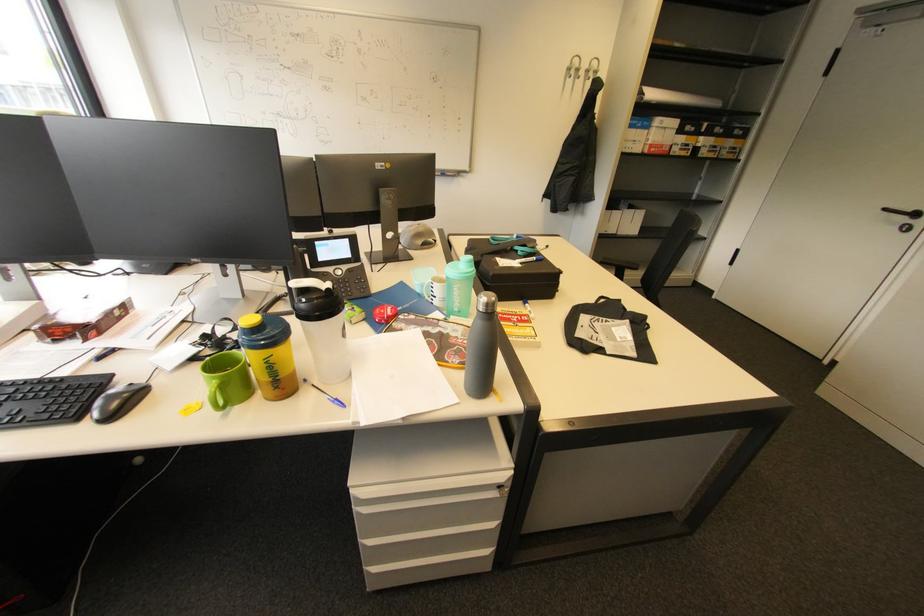
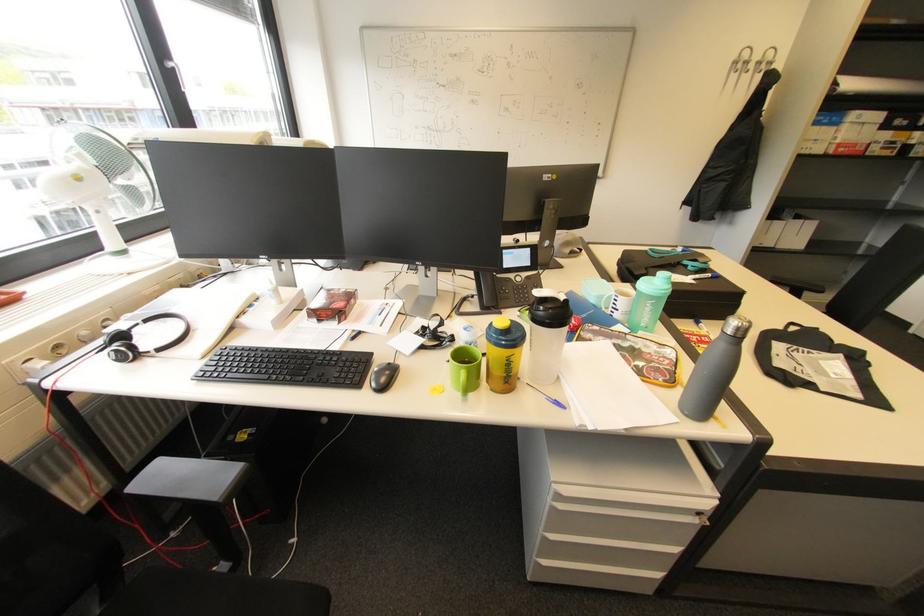
Where in the second image is the point corresponding to pixel 600 63 from the first image?

(775, 55)